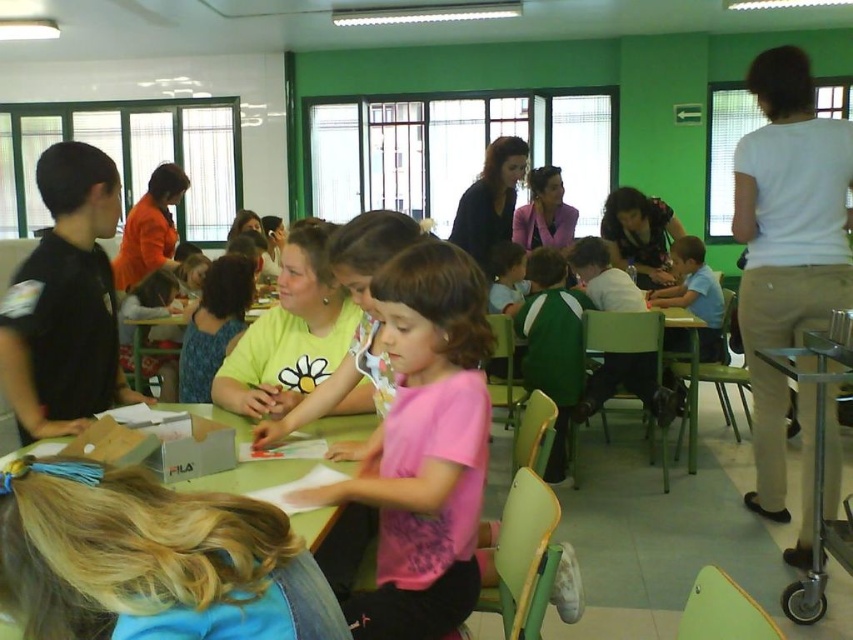
You are a teacher in the classroom. You notice the white cotton shirt at right and the green plastic table at center. Which object is located on top of the other?

The white cotton shirt at right is positioned over the green plastic table at center, meaning it is on top of the table.